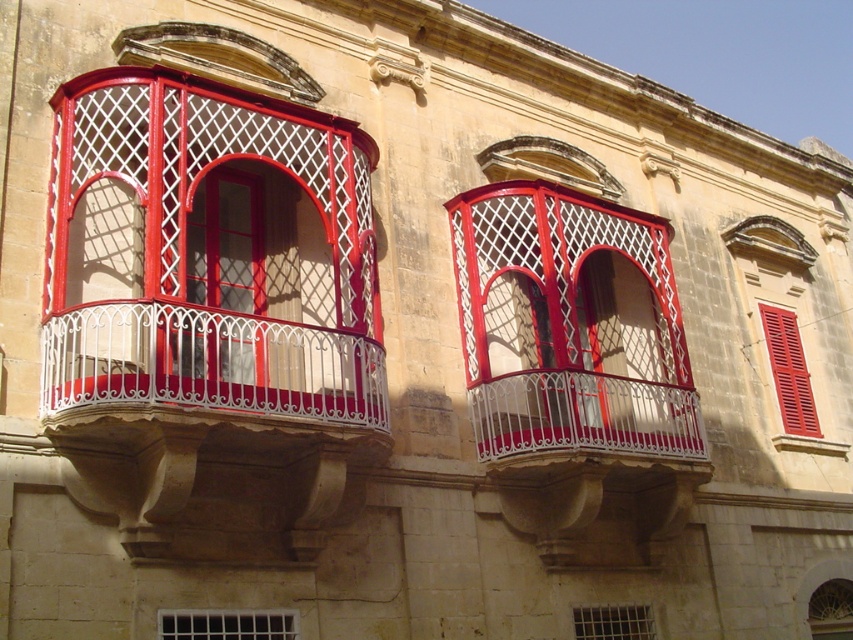
You are an architect inspecting the building facade. You notice the white wrought iron balcony at center and the clear glass fan at center. Which of these two elements has a larger physical size according to the architectural design?

The white wrought iron balcony at center is bigger than the clear glass fan at center, so the white wrought iron balcony at center has a larger physical size according to the architectural design.